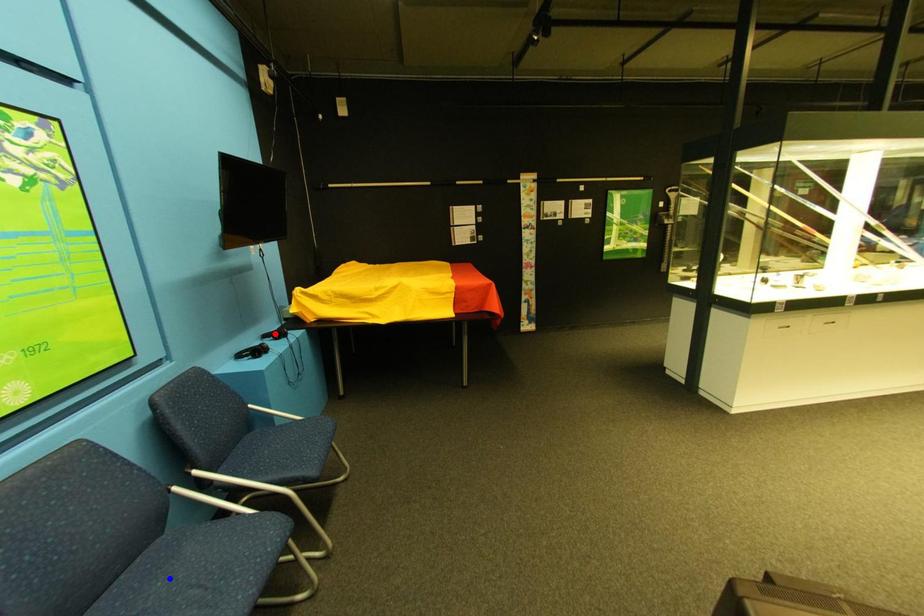
Question: In the image, two points are highlighted. Which point is nearer to the camera? Reply with the corresponding letter.

Choices:
 (A) blue point
 (B) red point

Answer: (A)